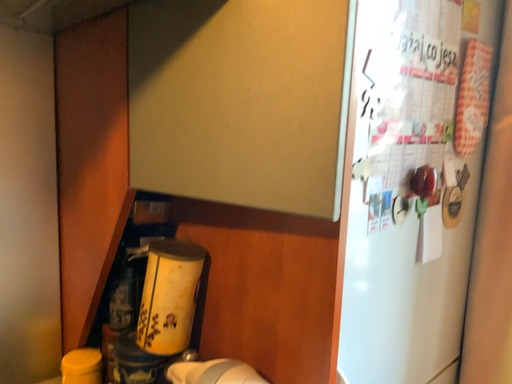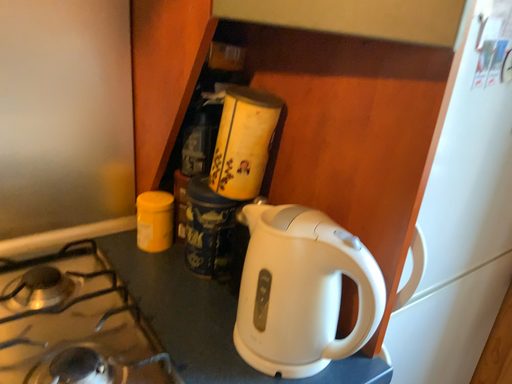
Question: How did the camera likely rotate when shooting the video?

Choices:
 (A) rotated upward
 (B) rotated downward

Answer: (B)